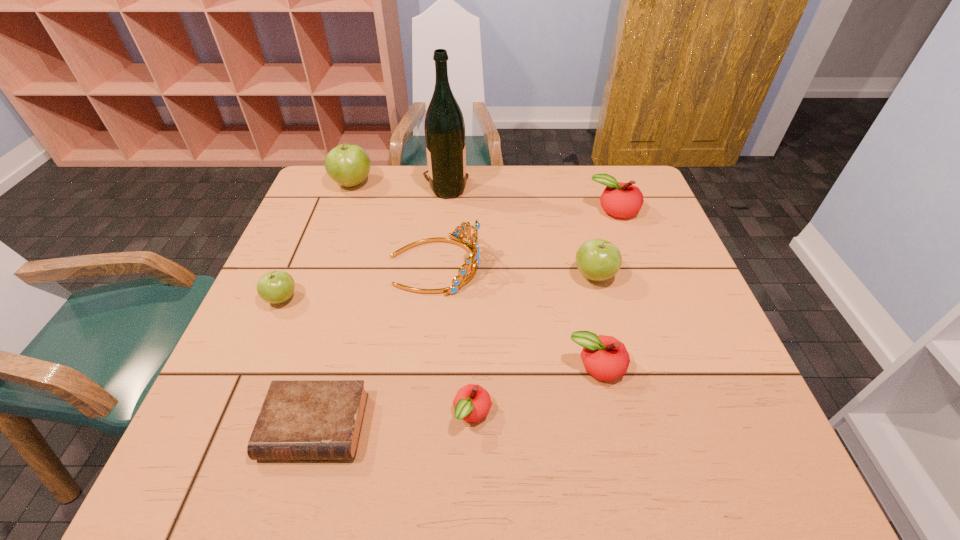
Where is `free space located on the back of the seventh farthest object`? free space located on the back of the seventh farthest object is located at coordinates (583, 305).

At what (x,y) coordinates should I click in order to perform the action: click on free point located on the back of the nearest red apple. Please return your answer as a coordinate pair (x, y). This screenshot has height=540, width=960. Looking at the image, I should click on (474, 286).

I want to click on wine bottle situated at the far edge, so click(x=444, y=127).

I want to click on object present at the near edge, so click(300, 419).

Find the location of a particular element. The image size is (960, 540). diary present at the left edge is located at coordinates (300, 419).

Image resolution: width=960 pixels, height=540 pixels. In order to click on object at the right edge in this screenshot , I will do click(623, 200).

You are a GUI agent. You are given a task and a screenshot of the screen. Output one action in this format:
    pyautogui.click(x=<x>, y=<y>)
    Task: Click on the object situated at the far left corner
    
    Given the screenshot: What is the action you would take?
    (x=347, y=164)

Where is `object that is at the near left corner`? object that is at the near left corner is located at coordinates (300, 419).

I want to click on object that is positioned at the far right corner, so click(x=623, y=200).

This screenshot has width=960, height=540. Identify the location of vacant space at the far edge. [595, 198].